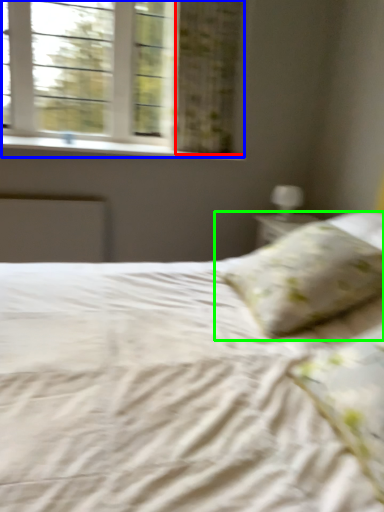
Question: Estimate the real-world distances between objects in this image. Which object is farther from curtain (highlighted by a red box), window (highlighted by a blue box) or pillow (highlighted by a green box)?

Choices:
 (A) window
 (B) pillow

Answer: (B)